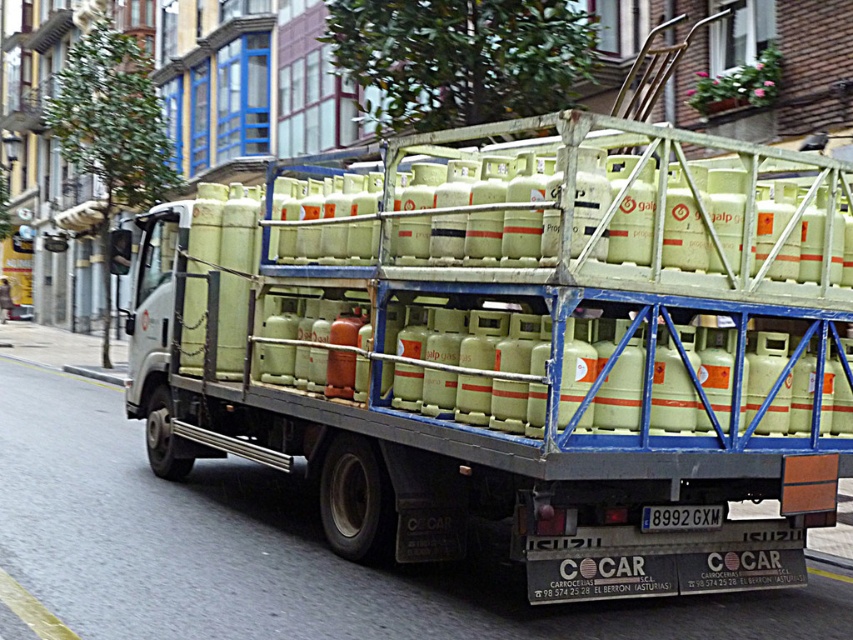
Question: Does matte green gas canisters at center come behind white plastic license plate at center?

Choices:
 (A) yes
 (B) no

Answer: (B)

Question: Does matte green gas canisters at center have a greater width compared to white plastic license plate at center?

Choices:
 (A) no
 (B) yes

Answer: (B)

Question: Where is matte green gas canisters at center located in relation to white plastic license plate at center in the image?

Choices:
 (A) left
 (B) right

Answer: (A)

Question: Which object appears closest to the camera in this image?

Choices:
 (A) matte green gas canisters at center
 (B) white plastic license plate at center

Answer: (A)